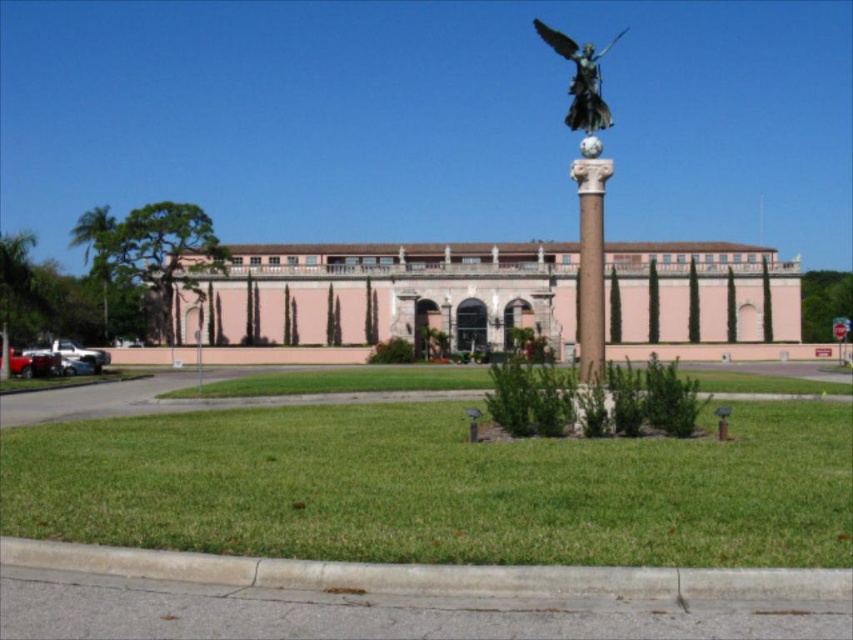
Question: Where is white marble column at center located in relation to bronze statue at center in the image?

Choices:
 (A) above
 (B) below

Answer: (B)

Question: Estimate the real-world distances between objects in this image. Which object is farther from the pink stone building at center?

Choices:
 (A) white marble column at center
 (B) bronze statue at center

Answer: (B)

Question: Which of the following is the closest to the observer?

Choices:
 (A) bronze statue at center
 (B) pink stone building at center
 (C) white marble column at center

Answer: (C)

Question: Which object is the closest to the bronze statue at center?

Choices:
 (A) pink stone building at center
 (B) white marble column at center

Answer: (B)

Question: Is white marble column at center below bronze statue at center?

Choices:
 (A) yes
 (B) no

Answer: (A)

Question: Is pink stone building at center to the left of white marble column at center from the viewer's perspective?

Choices:
 (A) no
 (B) yes

Answer: (B)